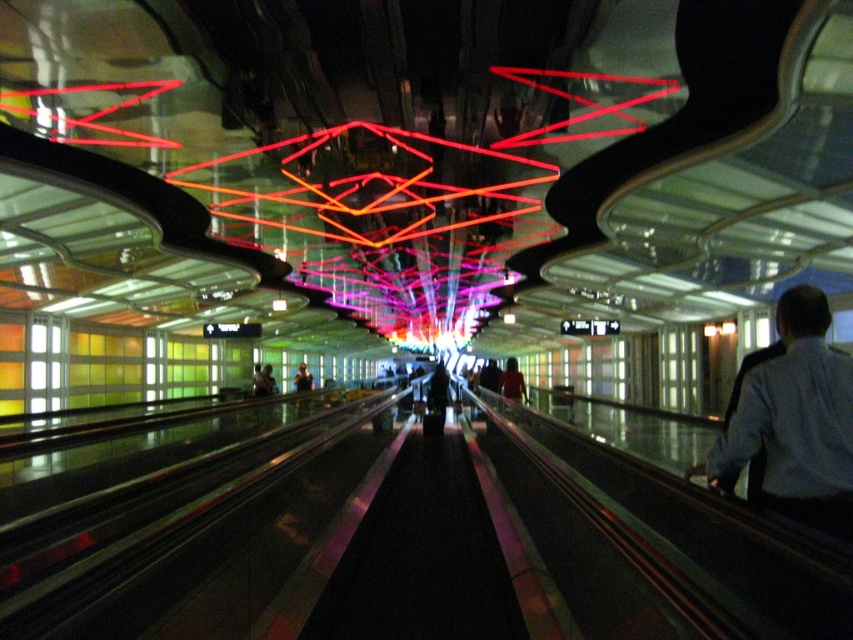
Question: From the image, what is the correct spatial relationship of light blue shirt at right in relation to matte black jacket at center?

Choices:
 (A) below
 (B) above

Answer: (B)

Question: Is light blue shirt at right thinner than matte black jacket at center?

Choices:
 (A) yes
 (B) no

Answer: (A)

Question: Which of the following is the closest to the observer?

Choices:
 (A) (790, 365)
 (B) (508, 385)

Answer: (A)

Question: Which point is farther to the camera?

Choices:
 (A) (825, 385)
 (B) (514, 369)

Answer: (B)

Question: Is light blue shirt at right further to the viewer compared to matte black jacket at center?

Choices:
 (A) yes
 (B) no

Answer: (B)